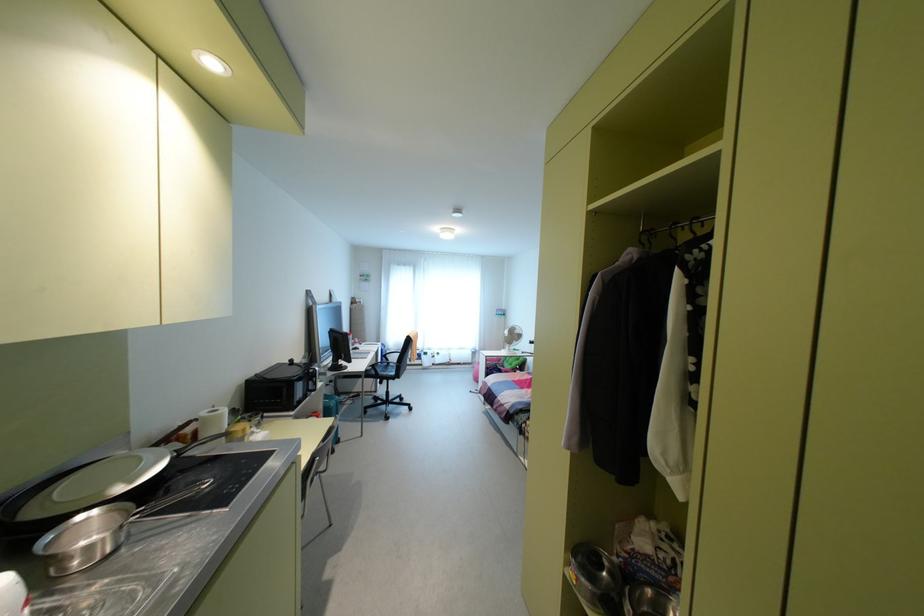
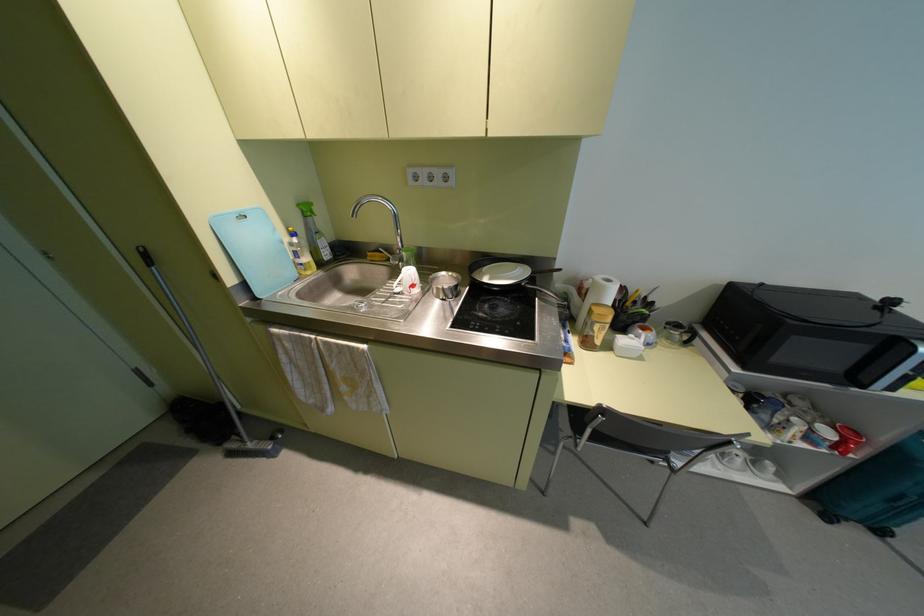
Find the pixel in the second image that matches point 337,440 in the first image.

(880, 531)